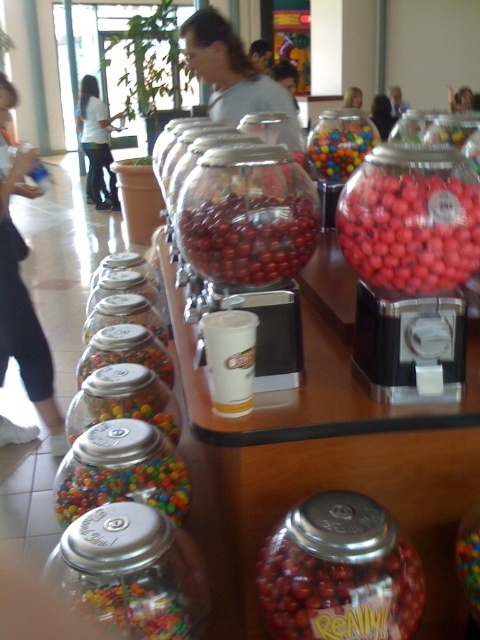
Find the location of a particular element. The height and width of the screenshot is (640, 480). multicolored glass jar at center is located at coordinates (132, 572).

Measure the distance between point (108, 576) and camera.

Point (108, 576) and camera are 37.14 inches apart.

Is point (59, 586) farther from camera compared to point (391, 93)?

No.

Find the location of a particular element. Image resolution: width=480 pixels, height=640 pixels. multicolored glass jar at center is located at coordinates (132, 572).

Which is more to the right, multicolored glossy gumballs at center or smooth skin face at upper center?

From the viewer's perspective, multicolored glossy gumballs at center appears more on the right side.

Which is behind, point (326, 154) or point (254, 60)?

The point (254, 60) is behind.

At what (x,y) coordinates should I click in order to perform the action: click on multicolored glossy gumballs at center. Please return your answer as a coordinate pair (x, y). This screenshot has height=640, width=480. Looking at the image, I should click on (339, 144).

Between translucent plastic jar at center and translucent plastic gumballs at center, which one has less height?

With less height is translucent plastic gumballs at center.

Measure the distance between translucent plastic jar at center and translucent plastic gumballs at center.

26.07 inches

Does point (101, 474) come in front of point (459, 577)?

No, (101, 474) is further to viewer.

The width and height of the screenshot is (480, 640). I want to click on translucent plastic jar at center, so click(121, 486).